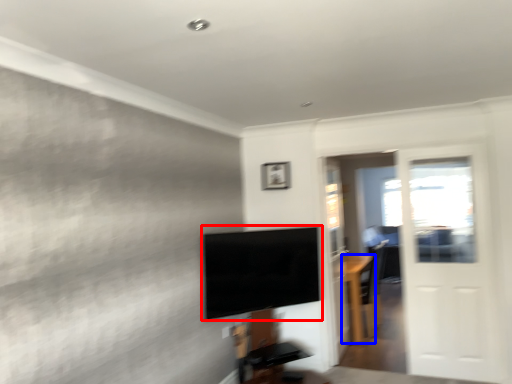
Question: Which point is further to the camera, television (highlighted by a red box) or furniture (highlighted by a blue box)?

Choices:
 (A) television
 (B) furniture

Answer: (B)